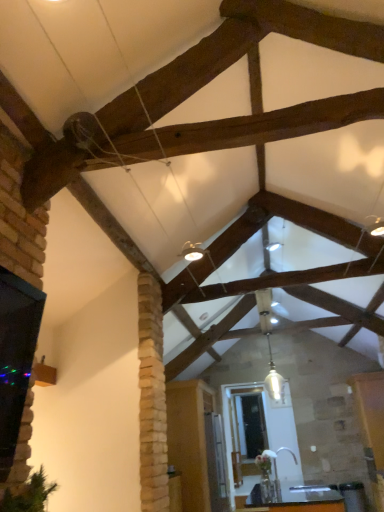
Question: Is black glass window at left inside the boundaries of wooden table at lower center, or outside?

Choices:
 (A) inside
 (B) outside

Answer: (B)

Question: Considering the positions of black glass window at left and wooden table at lower center in the image, is black glass window at left bigger or smaller than wooden table at lower center?

Choices:
 (A) big
 (B) small

Answer: (B)

Question: Which object is the closest to the white glass pendant light at center?

Choices:
 (A) black glass window at left
 (B) wooden table at lower center

Answer: (B)

Question: Which is nearer to the white glass pendant light at center?

Choices:
 (A) black glass window at left
 (B) wooden table at lower center

Answer: (B)